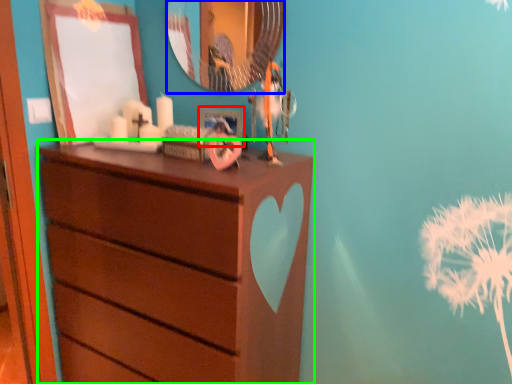
Question: Which object is positioned closest to picture frame (highlighted by a red box)? Select from mirror (highlighted by a blue box) and chest of drawers (highlighted by a green box).

Choices:
 (A) mirror
 (B) chest of drawers

Answer: (A)